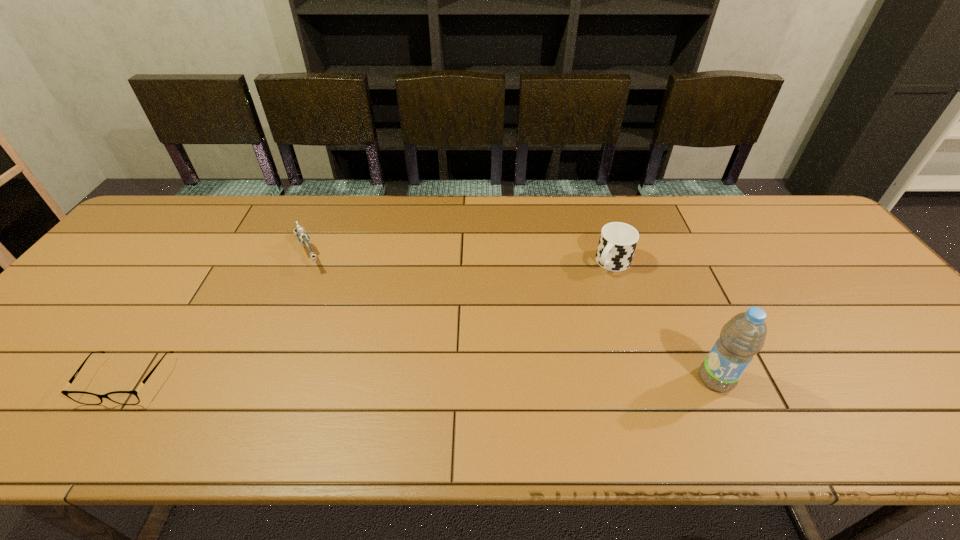
I want to click on spectacles, so click(121, 397).

Locate an element on the screen. This screenshot has width=960, height=540. the shortest object is located at coordinates (121, 397).

The width and height of the screenshot is (960, 540). I want to click on the rightmost object, so click(x=742, y=337).

In order to click on water bottle in this screenshot , I will do `click(742, 337)`.

I want to click on gun, so click(x=303, y=238).

This screenshot has width=960, height=540. Identify the location of the third object from right to left. (303, 238).

I want to click on cup, so click(618, 241).

Where is `vacant space located 0.400m on the back of the tallest object`? The height and width of the screenshot is (540, 960). vacant space located 0.400m on the back of the tallest object is located at coordinates (659, 251).

Image resolution: width=960 pixels, height=540 pixels. What are the coordinates of `vacant area situated aimed along the barrel of the gun` in the screenshot? It's located at (354, 356).

In order to click on vacant space located aimed along the barrel of the gun in this screenshot , I will do 333,314.